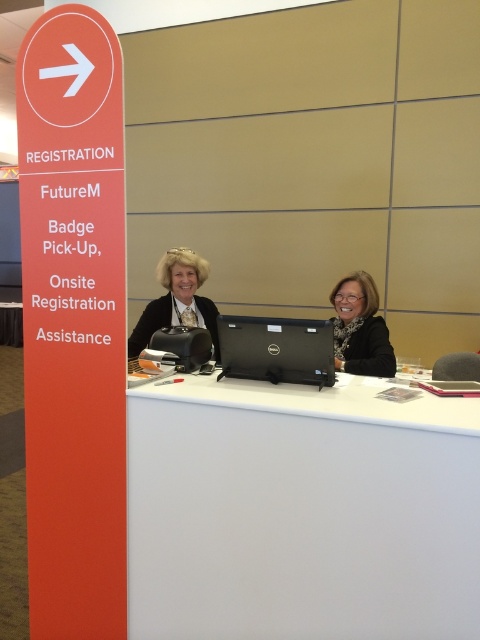
Question: Can you confirm if white plastic desk at center is thinner than matte black laptop at center?

Choices:
 (A) no
 (B) yes

Answer: (A)

Question: Which point is farther to the camera?

Choices:
 (A) white plastic desk at center
 (B) matte black laptop at center

Answer: (B)

Question: Which point is farther to the camera?

Choices:
 (A) matte black laptop at center
 (B) matte black glasses at center
 (C) white plastic desk at center

Answer: (A)

Question: Among these points, which one is farthest from the camera?

Choices:
 (A) (383, 355)
 (B) (357, 408)
 (C) (206, 308)

Answer: (C)

Question: Does matte black glasses at center appear under matte black laptop at center?

Choices:
 (A) yes
 (B) no

Answer: (A)

Question: Is white plastic desk at center thinner than matte black glasses at center?

Choices:
 (A) no
 (B) yes

Answer: (A)